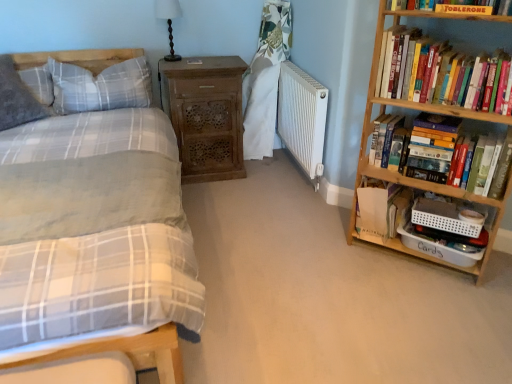
The width and height of the screenshot is (512, 384). What are the coordinates of `vacant region above white paper bag at right, which ranks as the 1th book in bottom-to-top order (from a real-world perspective)` in the screenshot? It's located at (380, 187).